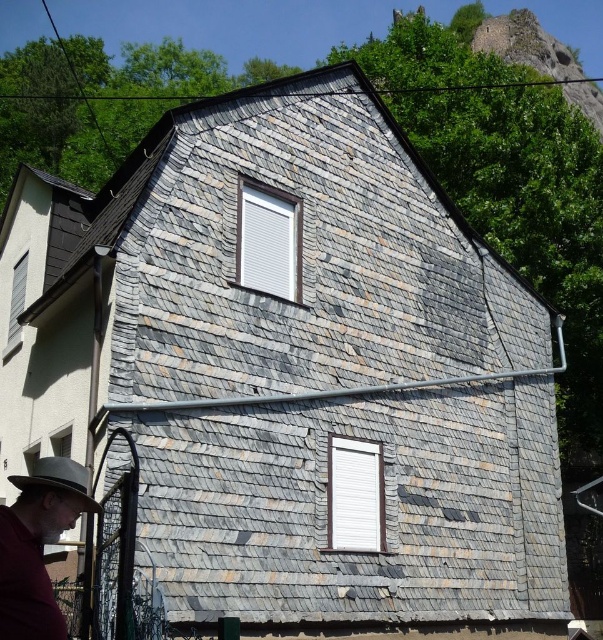
You are a delivery person who needs to place a package on the ground near the gray felt hat at lower left and the gray felt fedora at lower left. Which object should you place the package closer to if you want it to be near the smaller item?

You should place the package closer to the gray felt hat at lower left because it is smaller than the gray felt fedora at lower left.

You are standing in front of the traditional house and want to determine the spatial relationship between two points marked on the house. Which point, point (72,476) or point (30,484), is closer to you?

Point (72,476) is closer to you because it is further to the viewer than point (30,484).